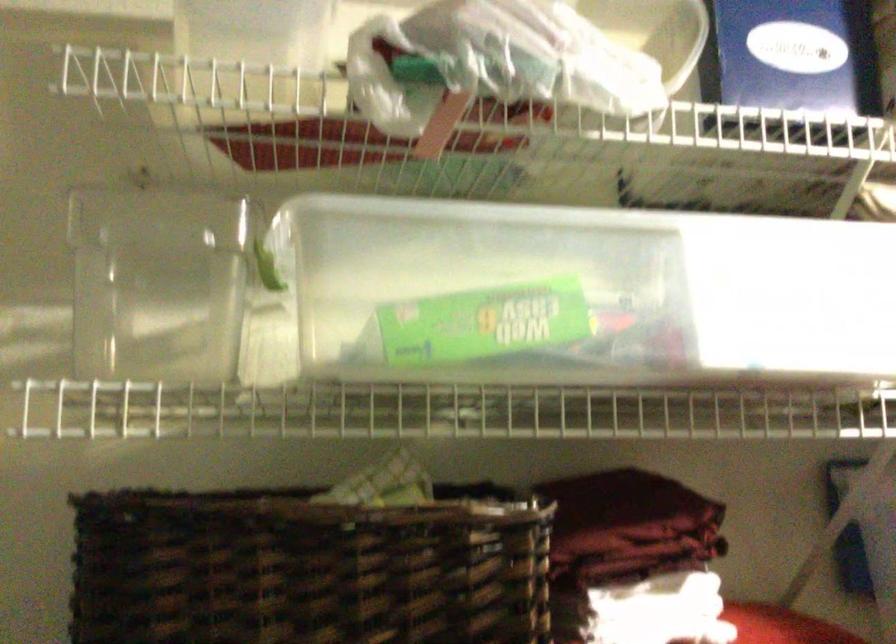
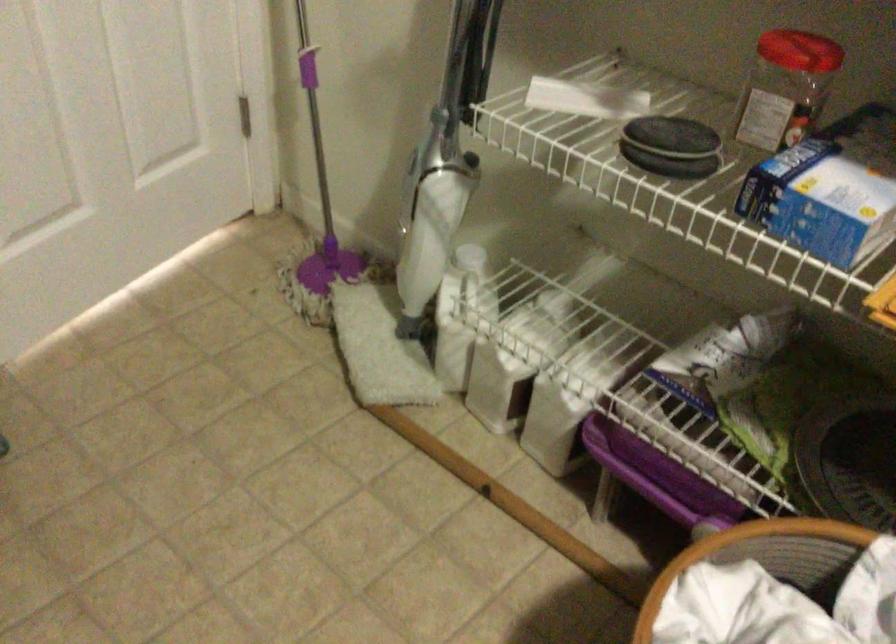
Based on the continuous images, in which direction is the camera rotating?

The rotation direction of the camera is left-down.